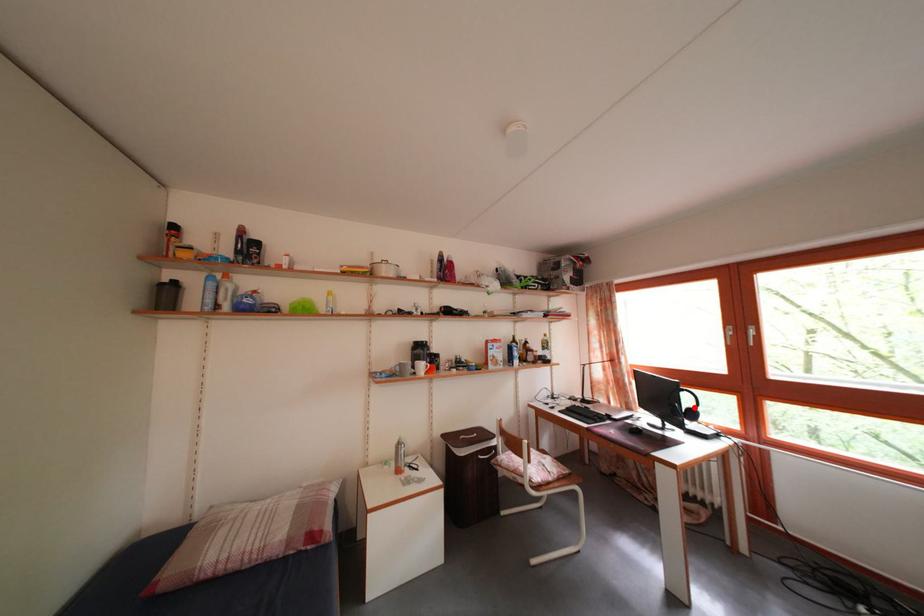
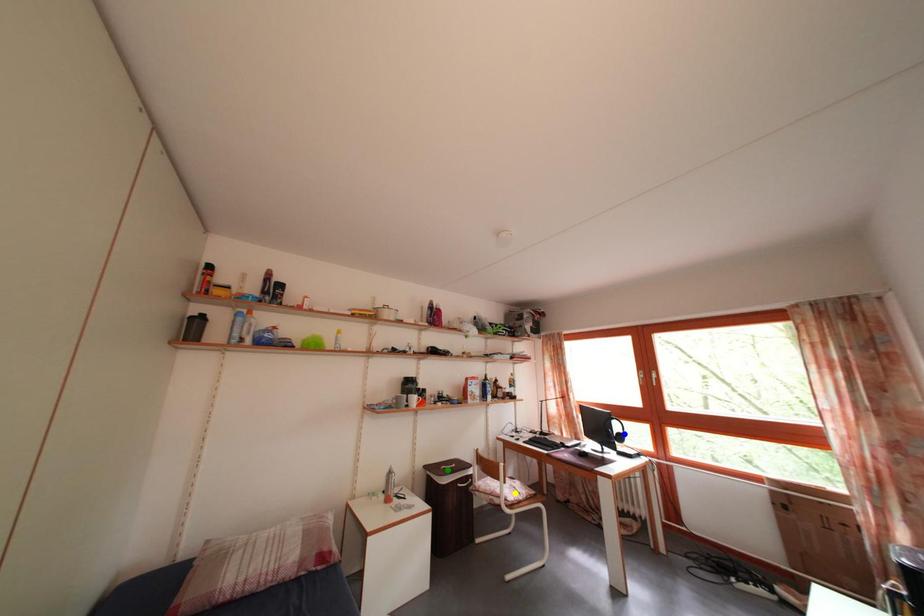
Question: I am providing you with two images of the same scene from different viewpoints. A red point is marked on the first image. You are given multiple points on the second image. Can you choose the point in image 2 that corresponds to the point in image 1?

Choices:
 (A) green point
 (B) yellow point
 (C) blue point

Answer: (C)